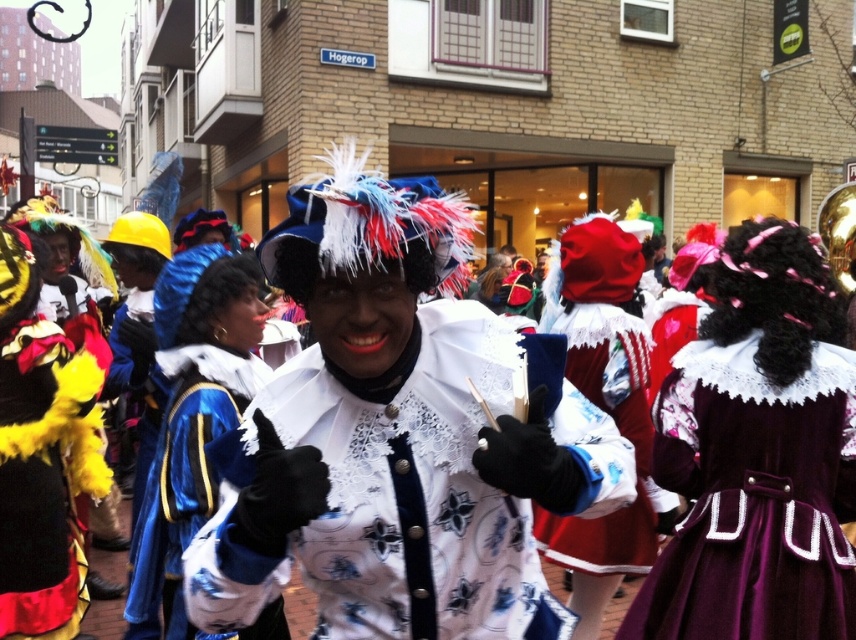
Based on the photo, between white lace jacket at center and white lace coat at center, which one has more height?

white lace coat at center

Locate an element on the screen. This screenshot has height=640, width=856. white lace jacket at center is located at coordinates (399, 435).

Where is `white lace jacket at center`? This screenshot has width=856, height=640. white lace jacket at center is located at coordinates (399, 435).

You are a GUI agent. You are given a task and a screenshot of the screen. Output one action in this format:
    pyautogui.click(x=<x>, y=<y>)
    Task: Click on the white lace jacket at center
    The height and width of the screenshot is (640, 856).
    Given the screenshot: What is the action you would take?
    pyautogui.click(x=399, y=435)

Which is more to the left, white lace jacket at center or velvet red dress at center?

From the viewer's perspective, white lace jacket at center appears more on the left side.

Is white lace jacket at center smaller than velvet red dress at center?

Yes, white lace jacket at center is smaller than velvet red dress at center.

Does point (229, 449) lie in front of point (642, 540)?

Yes, it is in front of point (642, 540).

This screenshot has width=856, height=640. I want to click on white lace jacket at center, so click(x=399, y=435).

Does white lace jacket at center appear under velvet maroon dress at center?

Actually, white lace jacket at center is above velvet maroon dress at center.

Does white lace jacket at center lie behind velvet maroon dress at center?

That is False.

Which is behind, point (384, 333) or point (762, 556)?

Positioned behind is point (762, 556).

In order to click on white lace jacket at center in this screenshot , I will do `click(399, 435)`.